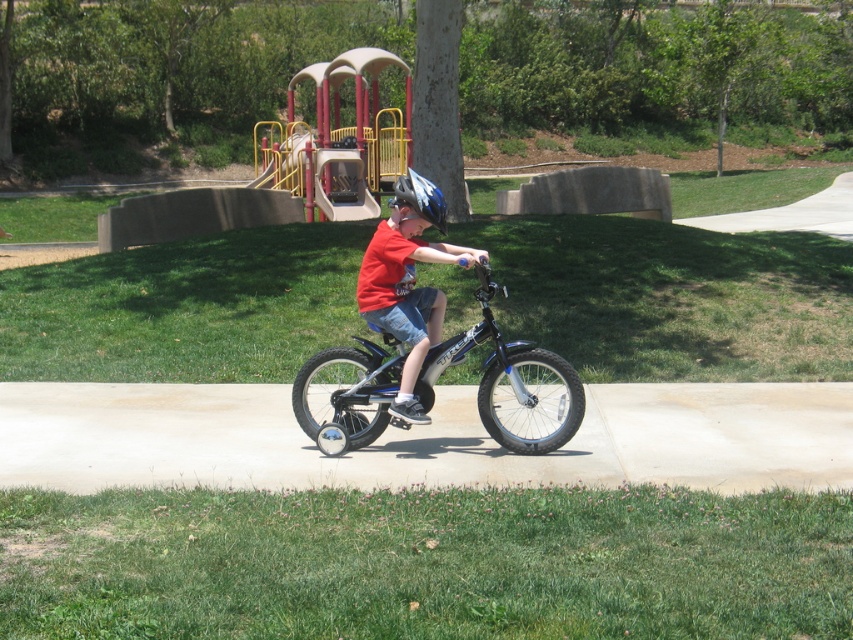
From the picture: Does smooth plastic slide at upper center come in front of matte red shirt at center?

No.

Is point (343, 220) farther from camera compared to point (442, 316)?

That is True.

Where is `smooth plastic slide at upper center`? This screenshot has width=853, height=640. smooth plastic slide at upper center is located at coordinates (338, 140).

You are a GUI agent. You are given a task and a screenshot of the screen. Output one action in this format:
    pyautogui.click(x=<x>, y=<y>)
    Task: Click on the smooth plastic slide at upper center
    
    Given the screenshot: What is the action you would take?
    pyautogui.click(x=338, y=140)

Who is shorter, smooth concrete pavement at center or matte blue helmet at center?

Standing shorter between the two is smooth concrete pavement at center.

Based on the photo, is smooth concrete pavement at center below matte blue helmet at center?

Correct, smooth concrete pavement at center is located below matte blue helmet at center.

Between point (119, 472) and point (396, 186), which one is positioned behind?

Positioned behind is point (396, 186).

Find the location of a particular element. smooth concrete pavement at center is located at coordinates (422, 438).

Between smooth concrete pavement at center and shiny metallic bicycle at center, which one is positioned lower?

Positioned lower is smooth concrete pavement at center.

Looking at this image, can you confirm if smooth concrete pavement at center is positioned above shiny metallic bicycle at center?

Incorrect, smooth concrete pavement at center is not positioned above shiny metallic bicycle at center.

Is point (281, 433) behind point (515, 392)?

Yes, point (281, 433) is farther from viewer.

Locate an element on the screen. The height and width of the screenshot is (640, 853). smooth concrete pavement at center is located at coordinates (422, 438).